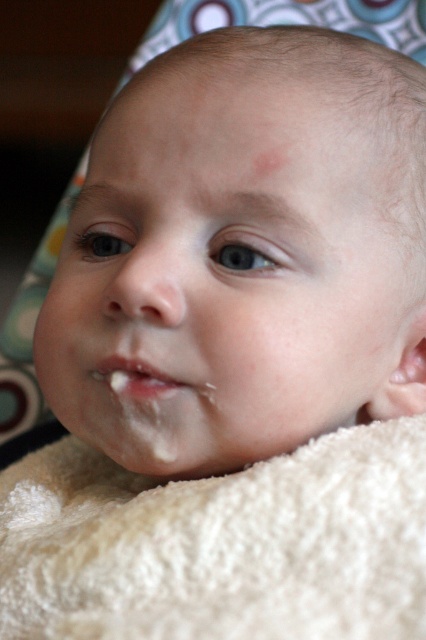
Question: Does smooth skin baby face at center appear on the right side of white fluffy blanket at lower center?

Choices:
 (A) no
 (B) yes

Answer: (B)

Question: Is smooth skin baby face at center below white matte lip at center?

Choices:
 (A) yes
 (B) no

Answer: (B)

Question: Which object appears farthest from the camera in this image?

Choices:
 (A) white matte lip at center
 (B) white fluffy blanket at lower center
 (C) smooth skin baby face at center

Answer: (A)

Question: Can you confirm if white fluffy blanket at lower center is positioned to the right of white matte lip at center?

Choices:
 (A) no
 (B) yes

Answer: (B)

Question: Which point is farther to the camera?

Choices:
 (A) (238, 243)
 (B) (170, 385)
 (C) (249, 538)

Answer: (B)

Question: Estimate the real-world distances between objects in this image. Which object is closer to the white matte lip at center?

Choices:
 (A) smooth skin baby face at center
 (B) white fluffy blanket at lower center

Answer: (A)